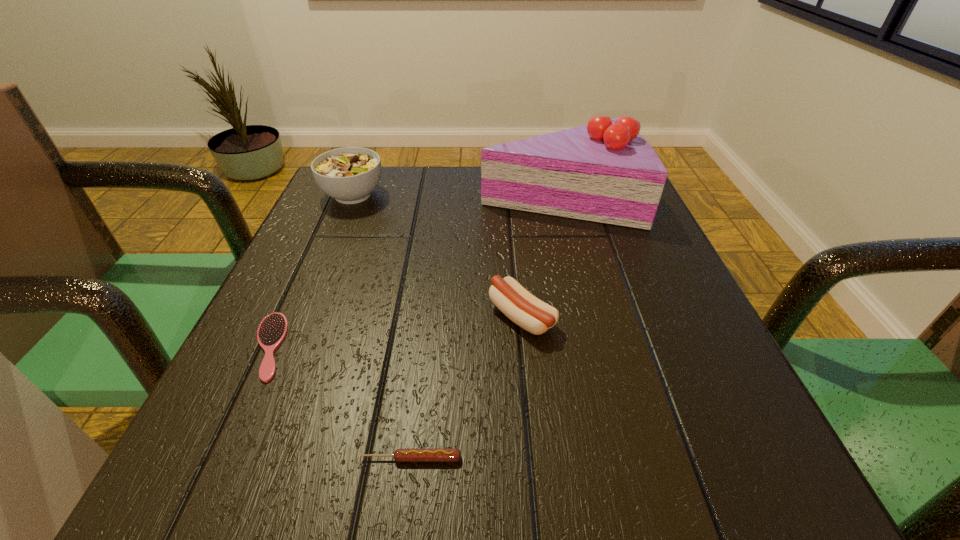
The width and height of the screenshot is (960, 540). I want to click on free space between the tallest object and the soup bowl, so click(456, 196).

In order to click on free space that is in between the cake and the soup bowl in this screenshot , I will do `click(456, 196)`.

Where is `vacant space in between the hairbrush and the second tallest object`? This screenshot has height=540, width=960. vacant space in between the hairbrush and the second tallest object is located at coordinates (311, 271).

Find the location of a particular element. This screenshot has height=540, width=960. empty space that is in between the soup bowl and the left sausage is located at coordinates (382, 327).

This screenshot has width=960, height=540. I want to click on free space between the fourth shortest object and the hairbrush, so click(311, 271).

The height and width of the screenshot is (540, 960). Find the location of `object that is the nearest to the fourth shortest object`. object that is the nearest to the fourth shortest object is located at coordinates (606, 172).

At what (x,y) coordinates should I click in order to perform the action: click on the fourth closest object relative to the nearest object. Please return your answer as a coordinate pair (x, y). Looking at the image, I should click on (349, 175).

Identify the location of free space that satisfies the following two spatial constraints: 1. on the back side of the hairbrush; 2. on the right side of the cake. This screenshot has width=960, height=540. (338, 198).

Locate an element on the screen. free location that satisfies the following two spatial constraints: 1. on the front side of the hairbrush; 2. on the left side of the left sausage is located at coordinates click(x=217, y=458).

Locate an element on the screen. The image size is (960, 540). vacant space that satisfies the following two spatial constraints: 1. on the back side of the second tallest object; 2. on the right side of the hairbrush is located at coordinates (339, 195).